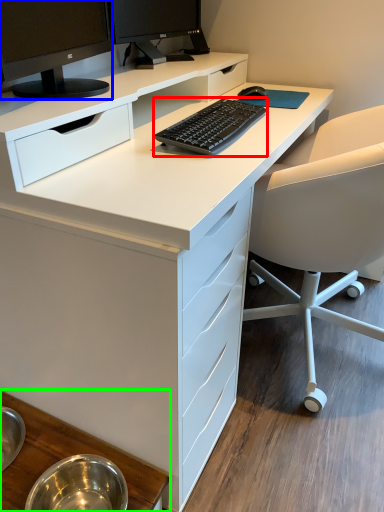
Question: Estimate the real-world distances between objects in this image. Which object is closer to computer keyboard (highlighted by a red box), computer monitor (highlighted by a blue box) or table (highlighted by a green box)?

Choices:
 (A) computer monitor
 (B) table

Answer: (A)